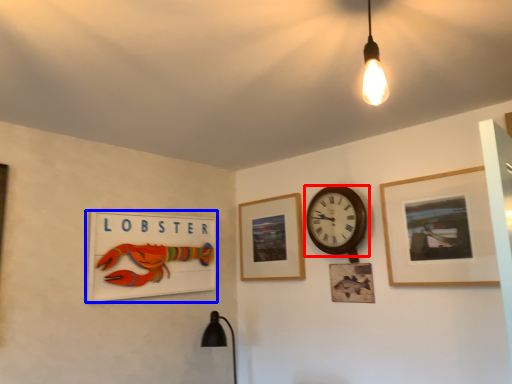
Question: Among these objects, which one is nearest to the camera, wall clock (highlighted by a red box) or picture frame (highlighted by a blue box)?

Choices:
 (A) wall clock
 (B) picture frame

Answer: (B)